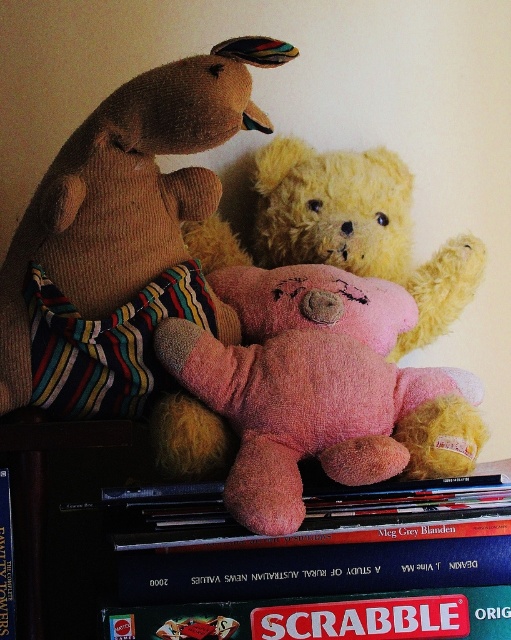
Question: Based on their relative distances, which object is farther from the soft pink plush at upper center?

Choices:
 (A) soft brown stuffed animal at upper left
 (B) fluffy pink teddy bear at center

Answer: (A)

Question: Can you confirm if soft pink plush at upper center is wider than soft brown stuffed animal at upper left?

Choices:
 (A) no
 (B) yes

Answer: (B)

Question: Which of the following is the closest to the observer?

Choices:
 (A) (72, 580)
 (B) (463, 429)

Answer: (B)

Question: Is soft brown stuffed animal at upper left further to the viewer compared to fluffy pink teddy bear at center?

Choices:
 (A) yes
 (B) no

Answer: (A)

Question: Which object is the closest to the soft pink plush at upper center?

Choices:
 (A) soft brown stuffed animal at upper left
 (B) fluffy pink teddy bear at center

Answer: (B)

Question: Does soft pink plush at upper center appear on the left side of fluffy pink teddy bear at center?

Choices:
 (A) no
 (B) yes

Answer: (B)